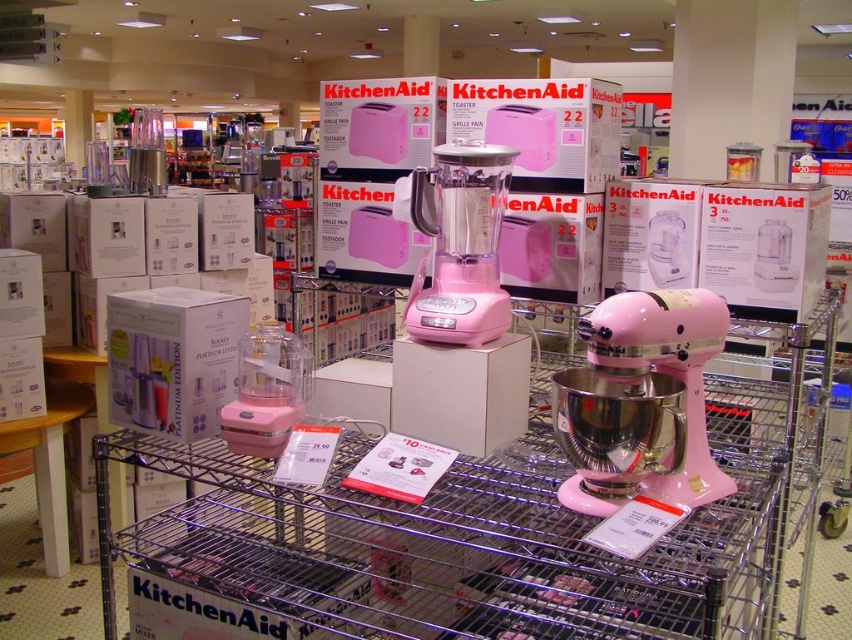
You are standing in front of the KitchenAid appliances display. There are two points marked on the display rack. Can you tell me which point, point 1 at coordinates (436, 292) or point 2 at coordinates (683, 296), is closer to you?

Point 1 at coordinates (436, 292) is closer to you because it is further to the camera than point 2 at coordinates (683, 296).

You are a customer looking at the KitchenAid appliances displayed in the store. You see the pink matte blender at center and the pink matte stand mixer at center. Which appliance is closer to you?

The pink matte blender at center is closer to you because it is further to the viewer than the pink matte stand mixer at center.

From the picture: You are a customer standing in front of the KitchenAid appliances display. You see two points marked as point (209, 392) and point (245, 426). Which point is closer to you?

Point (209, 392) is further to the camera than point (245, 426), so the point closer to you is point (245, 426).